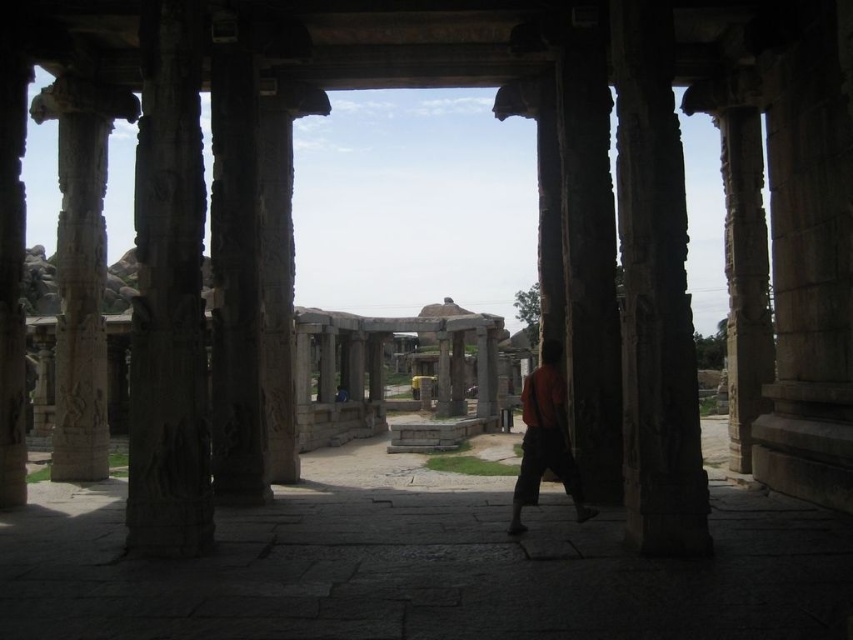
You are an archaeologist standing inside the ancient stone structure. You notice the carved stone column at left and the orange fabric at center. Which object is nearer to you?

The carved stone column at left is closer to the viewer than the orange fabric at center.

You are an archaeologist examining this ancient stone structure. You notice a carved stone column at left and an orange fabric at center. Which object is positioned higher relative to the other?

The carved stone column at left is located above the orange fabric at center, so it is positioned higher.

You are an archaeologist exploring the ancient stone structure. You see a carved stone column at left and an orange fabric at center. Which object is located to the left of the other?

The carved stone column at left is positioned on the left side of orange fabric at center.